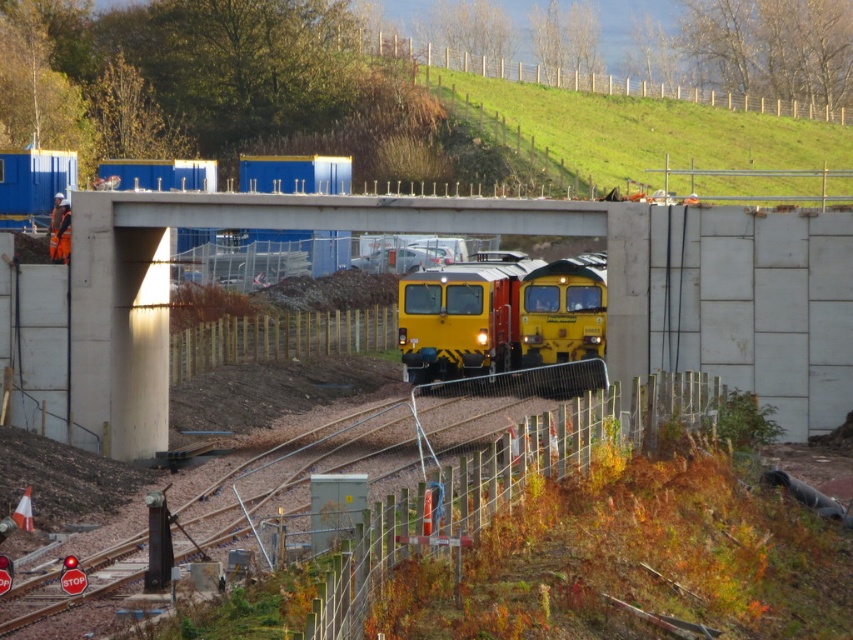
Which is behind, point (144, 209) or point (672, 106)?

The point (672, 106) is behind.

Does concrete at center have a greater height compared to green grass at upper center?

Incorrect, concrete at center's height is not larger of green grass at upper center's.

Is point (643, 230) positioned in front of point (686, 125)?

Yes, point (643, 230) is in front of point (686, 125).

Locate an element on the screen. Image resolution: width=853 pixels, height=640 pixels. concrete at center is located at coordinates (503, 234).

How distant is green grass at upper center from yellow matte train at center?

A distance of 24.17 meters exists between green grass at upper center and yellow matte train at center.

Does green grass at upper center have a greater height compared to yellow matte train at center?

Indeed, green grass at upper center has a greater height compared to yellow matte train at center.

Is point (836, 140) positioned after point (476, 376)?

That is True.

Find the location of a particular element. The image size is (853, 640). green grass at upper center is located at coordinates pyautogui.click(x=650, y=134).

From the picture: Is concrete at center further to camera compared to yellow matte train at center?

No.

Can you confirm if concrete at center is bigger than yellow matte train at center?

No.

This screenshot has height=640, width=853. What are the coordinates of `concrete at center` in the screenshot? It's located at (503, 234).

Image resolution: width=853 pixels, height=640 pixels. What are the coordinates of `concrete at center` in the screenshot? It's located at (503, 234).